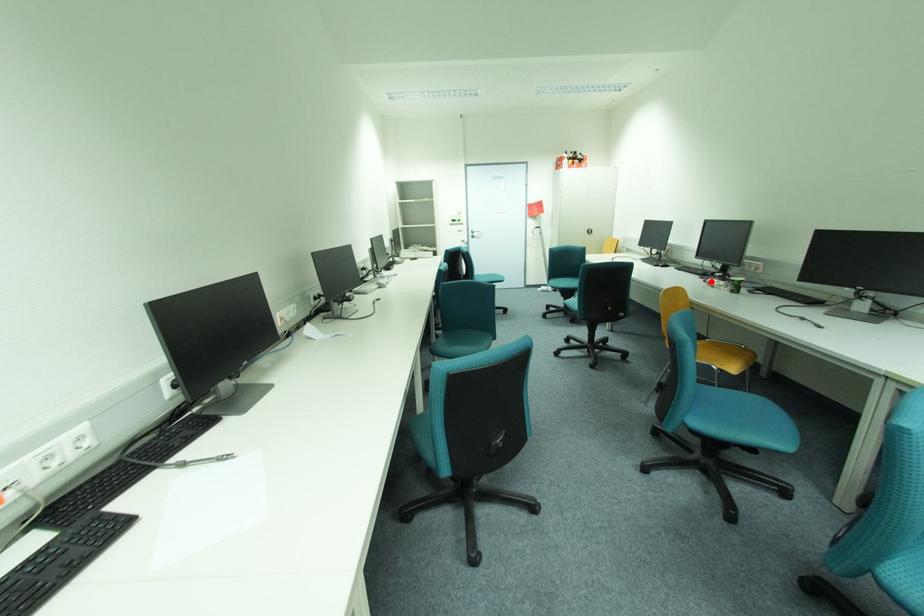
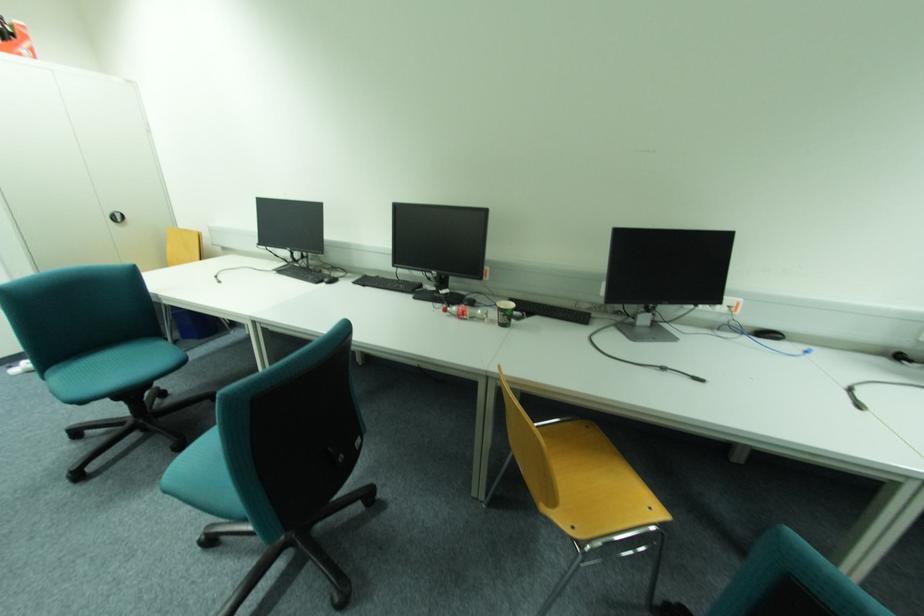
The point at the highlighted location is marked in the first image. Where is the corresponding point in the second image?

(451, 310)